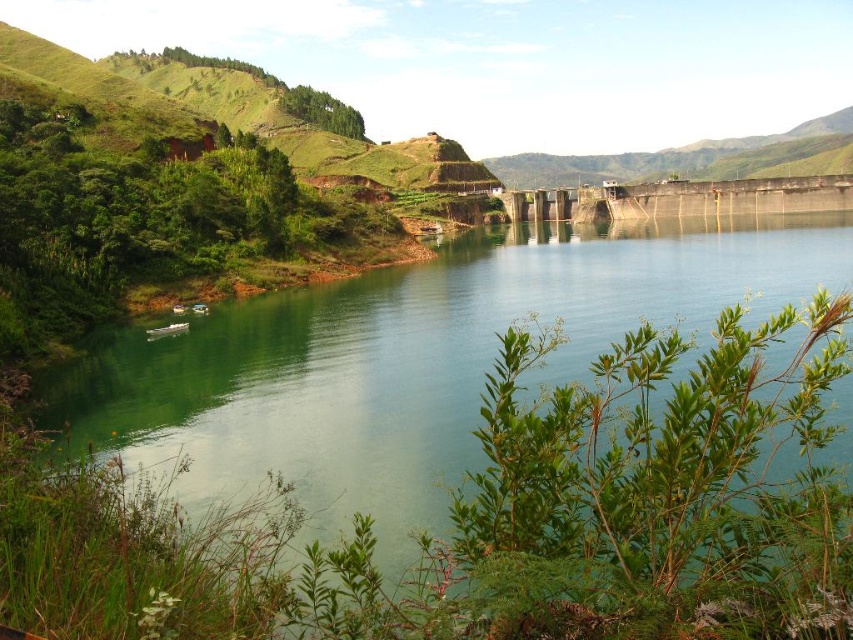
You are a photographer planning to capture the entire scene in one shot. You notice the green smooth water at center and the green leafy plant at lower right. Which object would require you to adjust your camera angle to include its full width in the frame?

The green smooth water at center requires adjusting the camera angle because it is wider than the green leafy plant at lower right.

You are a photographer planning to capture the green smooth water at center and the green leafy plant at lower right in a single frame. Based on their relative heights, which object will appear larger in the photo?

The green smooth water at center will appear larger in the photo because it has a greater height compared to the green leafy plant at lower right.

You are standing at the edge of the reservoir and see the green smooth water at center and the green leafy plant at lower right. Which object is closer to your left side?

The green leafy plant at lower right is closer to your left side because the green smooth water at center is positioned to its right.